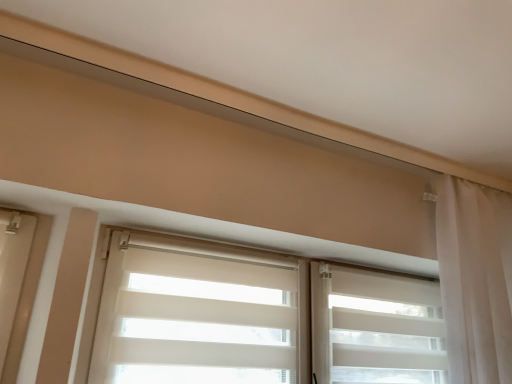
What do you see at coordinates (474, 282) in the screenshot? I see `white sheer curtain at right` at bounding box center [474, 282].

Locate an element on the screen. white sheer curtain at right is located at coordinates (474, 282).

Find the location of a particular element. The height and width of the screenshot is (384, 512). white matte/soft roller-shutter at center is located at coordinates (376, 327).

What do you see at coordinates (200, 314) in the screenshot?
I see `white sheer curtain at center` at bounding box center [200, 314].

I want to click on white sheer curtain at right, so click(x=474, y=282).

Is white sheer curtain at center in contact with white sheer curtain at right?

There is a gap between white sheer curtain at center and white sheer curtain at right.

From the image's perspective, is white sheer curtain at center located above white sheer curtain at right?

No, from the image's perspective, white sheer curtain at center is not over white sheer curtain at right.

Which is behind, point (267, 274) or point (493, 350)?

The point (267, 274) is more distant.

Is white sheer curtain at center bigger or smaller than white matte/soft roller-shutter at center?

Clearly, white sheer curtain at center is larger in size than white matte/soft roller-shutter at center.

Consider the image. Which is nearer, (151, 321) or (403, 287)?

Point (151, 321).

Is white sheer curtain at center positioned with its back to white matte/soft roller-shutter at center?

Yes, white matte/soft roller-shutter at center is at the back of white sheer curtain at center.

Considering the positions of objects white sheer curtain at center and white matte/soft roller-shutter at center in the image provided, who is more to the left, white sheer curtain at center or white matte/soft roller-shutter at center?

Positioned to the left is white sheer curtain at center.

Does white matte/soft roller-shutter at center turn towards white sheer curtain at right?

Yes, white matte/soft roller-shutter at center is aimed at white sheer curtain at right.

From the image's perspective, which one is positioned lower, white matte/soft roller-shutter at center or white sheer curtain at right?

From the image's view, white matte/soft roller-shutter at center is below.

Is white matte/soft roller-shutter at center bigger than white sheer curtain at right?

No.

Relative to white sheer curtain at right, is white matte/soft roller-shutter at center in front or behind?

In the image, white matte/soft roller-shutter at center appears behind white sheer curtain at right.

This screenshot has height=384, width=512. What are the coordinates of `shutter that appears below the white sheer curtain at right (from the image's perspective)` in the screenshot? It's located at (376, 327).

From a real-world perspective, is white sheer curtain at right physically below white matte/soft roller-shutter at center?

No, from a real-world perspective, white sheer curtain at right is not beneath white matte/soft roller-shutter at center.

Looking at the image, does white sheer curtain at right seem bigger or smaller compared to white matte/soft roller-shutter at center?

Considering their sizes, white sheer curtain at right takes up more space than white matte/soft roller-shutter at center.

Does white sheer curtain at right have a lesser width compared to white matte/soft roller-shutter at center?

In fact, white sheer curtain at right might be wider than white matte/soft roller-shutter at center.

Considering the relative positions of white sheer curtain at right and white sheer curtain at center in the image provided, is white sheer curtain at right behind white sheer curtain at center?

Yes, it is behind white sheer curtain at center.

Considering the positions of point (480, 206) and point (132, 341), is point (480, 206) closer or farther from the camera than point (132, 341)?

Point (480, 206) is farther from the camera than point (132, 341).

Could you tell me if white sheer curtain at right is turned towards white sheer curtain at center?

No.

How many degrees apart are the facing directions of white sheer curtain at right and white sheer curtain at center?

There is a 0.211-degree angle between the facing directions of white sheer curtain at right and white sheer curtain at center.

Does white matte/soft roller-shutter at center have a greater height compared to white sheer curtain at center?

No, white matte/soft roller-shutter at center is not taller than white sheer curtain at center.

Can we say white matte/soft roller-shutter at center lies outside white sheer curtain at center?

No, white matte/soft roller-shutter at center is not entirely external to white sheer curtain at center.

Considering the positions of points (362, 332) and (426, 361), is point (362, 332) farther from camera compared to point (426, 361)?

No, (362, 332) is closer to viewer.

Consider the image. Is white matte/soft roller-shutter at center far from white sheer curtain at center?

Actually, white matte/soft roller-shutter at center and white sheer curtain at center are a little close together.

Locate an element on the screen. curtain lying on the right of white sheer curtain at center is located at coordinates [474, 282].

This screenshot has height=384, width=512. In order to click on shutter below the white sheer curtain at center (from a real-world perspective) in this screenshot , I will do `click(376, 327)`.

Based on the photo, considering their positions, is white sheer curtain at right positioned further to white sheer curtain at center than white matte/soft roller-shutter at center?

white sheer curtain at right is further to white sheer curtain at center.

Estimate the real-world distances between objects in this image. Which object is closer to white sheer curtain at right, white matte/soft roller-shutter at center or white sheer curtain at center?

Among the two, white matte/soft roller-shutter at center is located nearer to white sheer curtain at right.

Looking at the image, which one is located further to white matte/soft roller-shutter at center, white sheer curtain at center or white sheer curtain at right?

white sheer curtain at right.

From the image, which object appears to be farther from white matte/soft roller-shutter at center, white sheer curtain at right or white sheer curtain at center?

The object further to white matte/soft roller-shutter at center is white sheer curtain at right.

Considering their positions, is white sheer curtain at center positioned closer to white sheer curtain at right than white matte/soft roller-shutter at center?

white matte/soft roller-shutter at center lies closer to white sheer curtain at right than the other object.

Based on their spatial positions, is white matte/soft roller-shutter at center or white sheer curtain at right further from white sheer curtain at center?

white sheer curtain at right is further to white sheer curtain at center.

Identify the location of shutter situated between white sheer curtain at center and white sheer curtain at right from left to right. This screenshot has height=384, width=512. (376, 327).